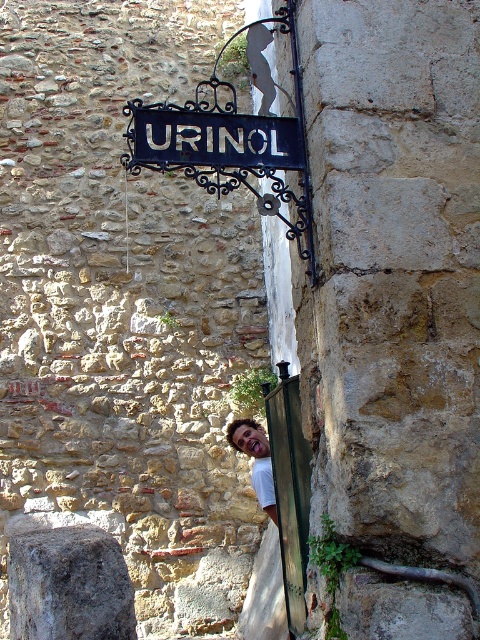
Can you confirm if black wrought iron sign at upper center is wider than smooth skin face at lower center?

Yes.

Which is behind, point (186, 132) or point (259, 451)?

The point (259, 451) is more distant.

Is point (227, 116) positioned before point (257, 456)?

Yes.

Identify the location of black wrought iron sign at upper center. The height and width of the screenshot is (640, 480). (211, 138).